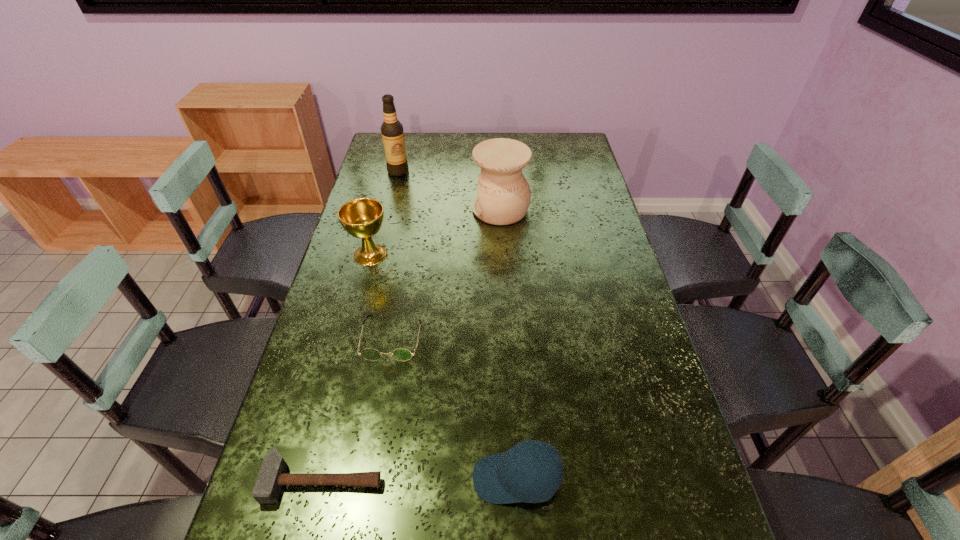
Where is `alcohol that is at the left edge`? alcohol that is at the left edge is located at coordinates (392, 132).

Where is `chalice that is at the left edge`? chalice that is at the left edge is located at coordinates (362, 218).

The image size is (960, 540). What are the coordinates of `spectacles at the left edge` in the screenshot? It's located at (400, 354).

Locate an element on the screen. The image size is (960, 540). hammer located at the left edge is located at coordinates (272, 475).

Image resolution: width=960 pixels, height=540 pixels. Identify the location of free space at the far edge of the desktop. (423, 147).

Locate an element on the screen. The height and width of the screenshot is (540, 960). free space at the left edge is located at coordinates tap(341, 249).

Locate an element on the screen. The height and width of the screenshot is (540, 960). free space at the right edge of the desktop is located at coordinates (624, 289).

Find the location of a particular element. Image resolution: width=960 pixels, height=540 pixels. vacant point located between the third shortest object and the tallest object is located at coordinates (458, 325).

Where is `vacant area that lies between the fifth tallest object and the tallest object`? vacant area that lies between the fifth tallest object and the tallest object is located at coordinates (396, 254).

The width and height of the screenshot is (960, 540). I want to click on vacant area that lies between the spectacles and the chalice, so click(381, 296).